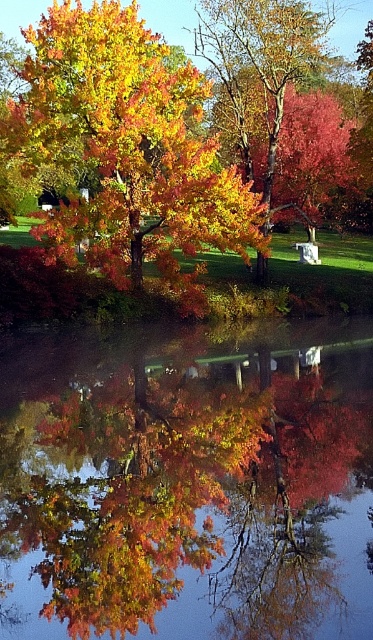
Question: Can you confirm if glossy reflective water at center is smaller than shiny golden leaves at center?

Choices:
 (A) no
 (B) yes

Answer: (B)

Question: Which point is farther to the camera?

Choices:
 (A) (95, 116)
 (B) (220, 582)

Answer: (A)

Question: Which of the following is the closest to the observer?

Choices:
 (A) glossy reflective water at center
 (B) shiny golden leaves at center

Answer: (A)

Question: Can you confirm if glossy reflective water at center is positioned to the left of shiny golden leaves at center?

Choices:
 (A) yes
 (B) no

Answer: (B)

Question: Is glossy reflective water at center to the right of shiny golden leaves at center from the viewer's perspective?

Choices:
 (A) yes
 (B) no

Answer: (A)